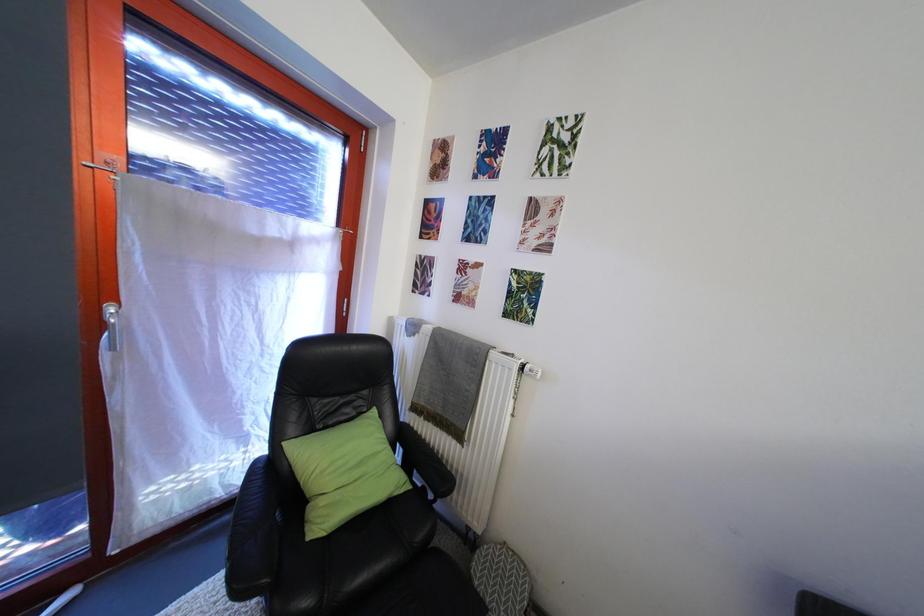
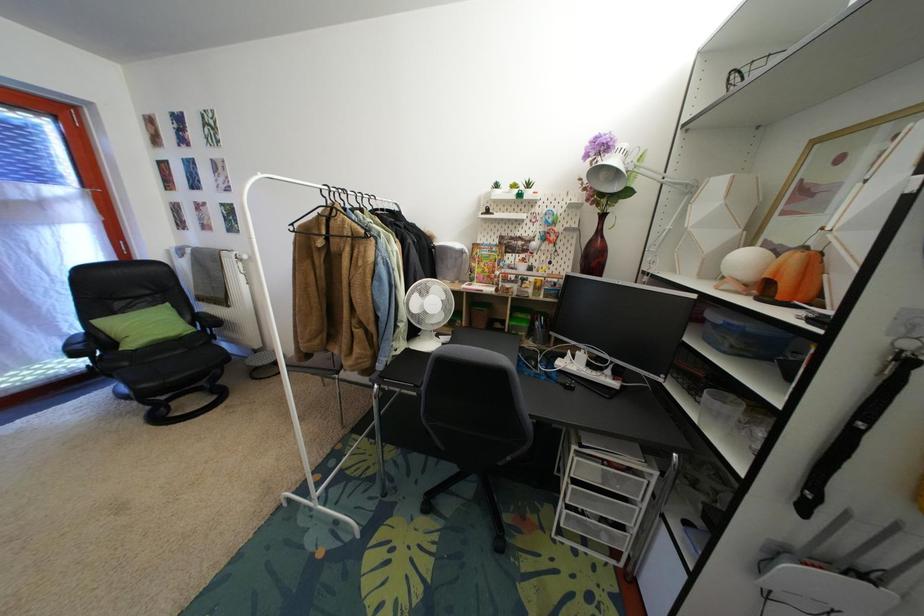
What movement of the cameraman would produce the second image?

The cameraman walked toward right, backward.